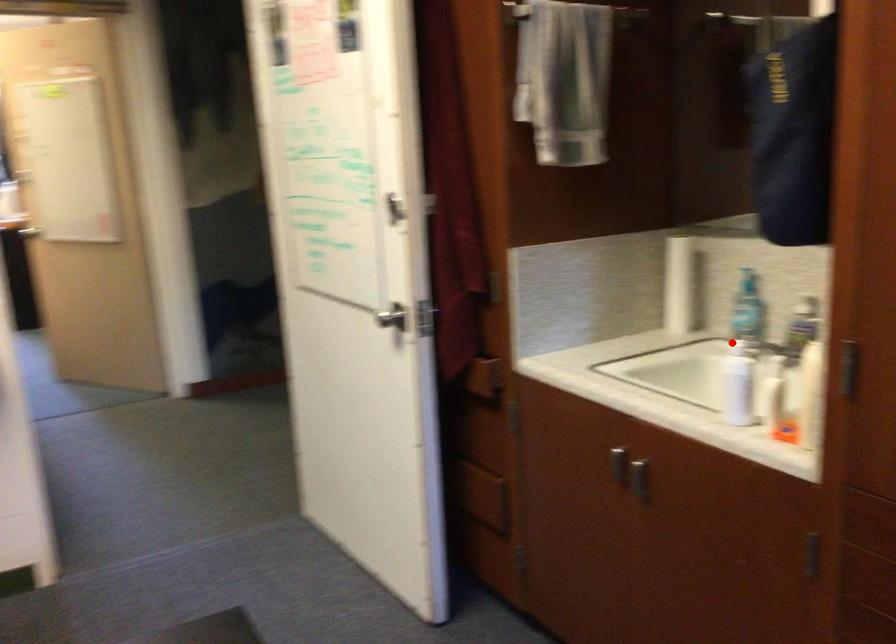
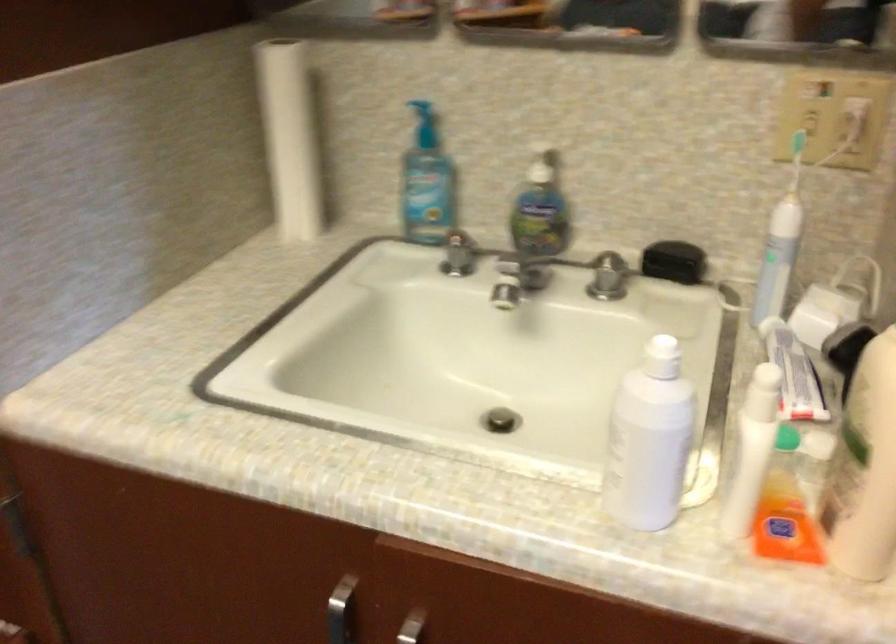
Question: I am providing you with two images of the same scene from different viewpoints. A red point is shown in image1. For the corresponding object point in image2, is it positioned nearer or farther from the camera?

Choices:
 (A) Nearer
 (B) Farther

Answer: (A)